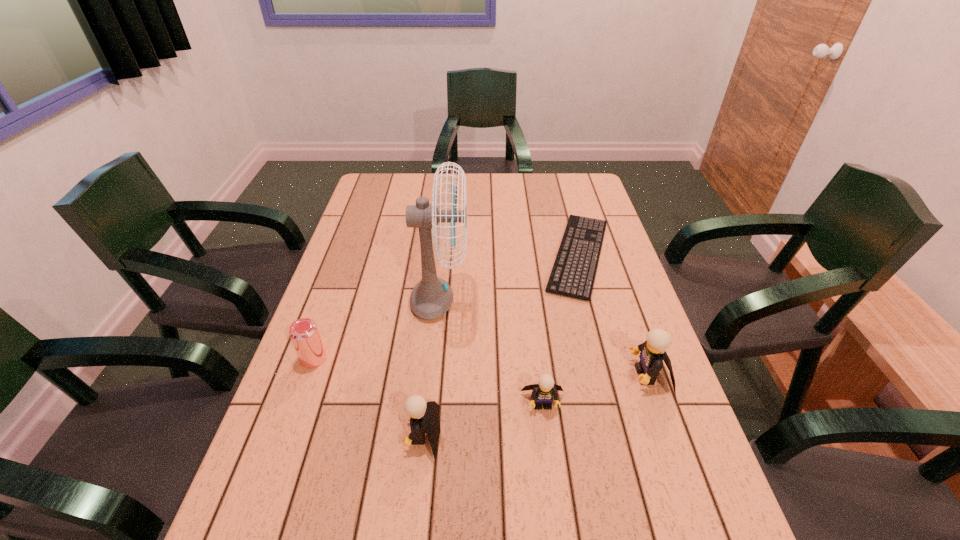
The width and height of the screenshot is (960, 540). In order to click on the leftmost Lego in this screenshot , I will do `click(424, 417)`.

Image resolution: width=960 pixels, height=540 pixels. In order to click on the second Lego from left to right in this screenshot , I will do `click(543, 392)`.

You are a GUI agent. You are given a task and a screenshot of the screen. Output one action in this format:
    pyautogui.click(x=<x>, y=<y>)
    Task: Click on the shortest Lego
    The image size is (960, 540).
    Given the screenshot: What is the action you would take?
    pyautogui.click(x=543, y=392)

Identify the location of the tallest Lego. The width and height of the screenshot is (960, 540). (653, 351).

Where is `the rightmost Lego`? Image resolution: width=960 pixels, height=540 pixels. the rightmost Lego is located at coordinates (653, 351).

In order to click on the tallest object in this screenshot , I will do `click(432, 297)`.

Locate an element on the screen. The width and height of the screenshot is (960, 540). the shortest object is located at coordinates (592, 230).

Where is `the leftmost object`? the leftmost object is located at coordinates (304, 333).

You are a GUI agent. You are given a task and a screenshot of the screen. Output one action in this format:
    pyautogui.click(x=<x>, y=<y>)
    Task: Click on the vacant area located 0.100m on the front-facing side of the leftmost Lego
    The width and height of the screenshot is (960, 540).
    Given the screenshot: What is the action you would take?
    pyautogui.click(x=358, y=434)

At what (x,y) coordinates should I click in order to perform the action: click on vacant space located on the front-facing side of the leftmost Lego. Please return your answer as a coordinate pair (x, y). This screenshot has width=960, height=540. Looking at the image, I should click on (269, 434).